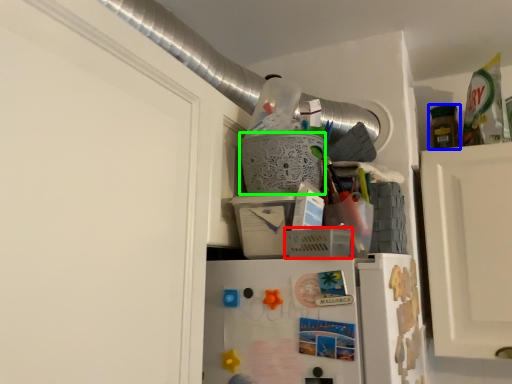
Question: Which object is the closest to the basket (highlighted by a red box)? Choose among these: bottle (highlighted by a blue box) or basket (highlighted by a green box).

Choices:
 (A) bottle
 (B) basket

Answer: (B)